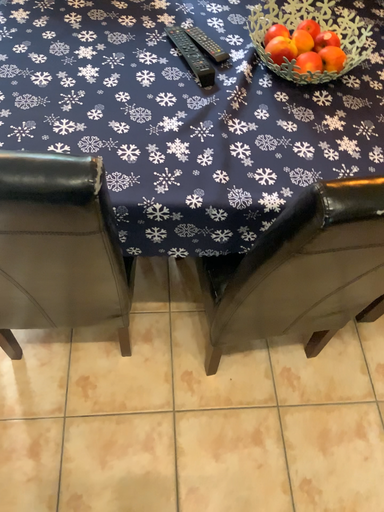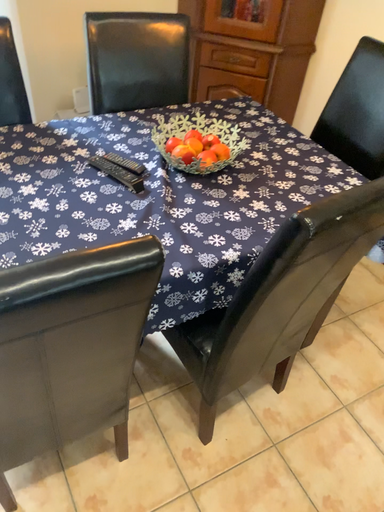
Question: Which way did the camera rotate in the video?

Choices:
 (A) rotated right
 (B) rotated left

Answer: (A)